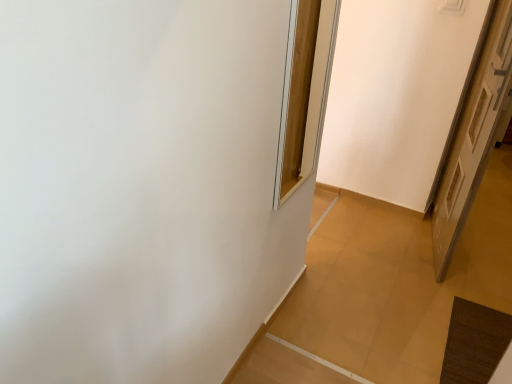
Question: From a real-world perspective, is wooden frame at upper center on top of white wooden door at right?

Choices:
 (A) no
 (B) yes

Answer: (B)

Question: Is wooden frame at upper center positioned with its back to white wooden door at right?

Choices:
 (A) no
 (B) yes

Answer: (A)

Question: From the image's perspective, does wooden frame at upper center appear higher than white wooden door at right?

Choices:
 (A) no
 (B) yes

Answer: (B)

Question: From a real-world perspective, is wooden frame at upper center located beneath white wooden door at right?

Choices:
 (A) no
 (B) yes

Answer: (A)

Question: Does wooden frame at upper center contain white wooden door at right?

Choices:
 (A) no
 (B) yes

Answer: (A)

Question: Can you confirm if wooden frame at upper center is shorter than white wooden door at right?

Choices:
 (A) no
 (B) yes

Answer: (B)

Question: From a real-world perspective, is white wooden door at right physically below wooden frame at upper center?

Choices:
 (A) no
 (B) yes

Answer: (B)

Question: From the image's perspective, is white wooden door at right below wooden frame at upper center?

Choices:
 (A) no
 (B) yes

Answer: (B)

Question: From a real-world perspective, is white wooden door at right over wooden frame at upper center?

Choices:
 (A) yes
 (B) no

Answer: (B)

Question: Considering the relative positions of white wooden door at right and wooden frame at upper center in the image provided, is white wooden door at right to the right of wooden frame at upper center from the viewer's perspective?

Choices:
 (A) no
 (B) yes

Answer: (B)

Question: Considering the relative sizes of white wooden door at right and wooden frame at upper center in the image provided, is white wooden door at right smaller than wooden frame at upper center?

Choices:
 (A) no
 (B) yes

Answer: (A)

Question: Considering the relative sizes of white wooden door at right and wooden frame at upper center in the image provided, is white wooden door at right thinner than wooden frame at upper center?

Choices:
 (A) no
 (B) yes

Answer: (A)

Question: Is white wooden door at right inside the boundaries of wooden frame at upper center, or outside?

Choices:
 (A) outside
 (B) inside

Answer: (A)